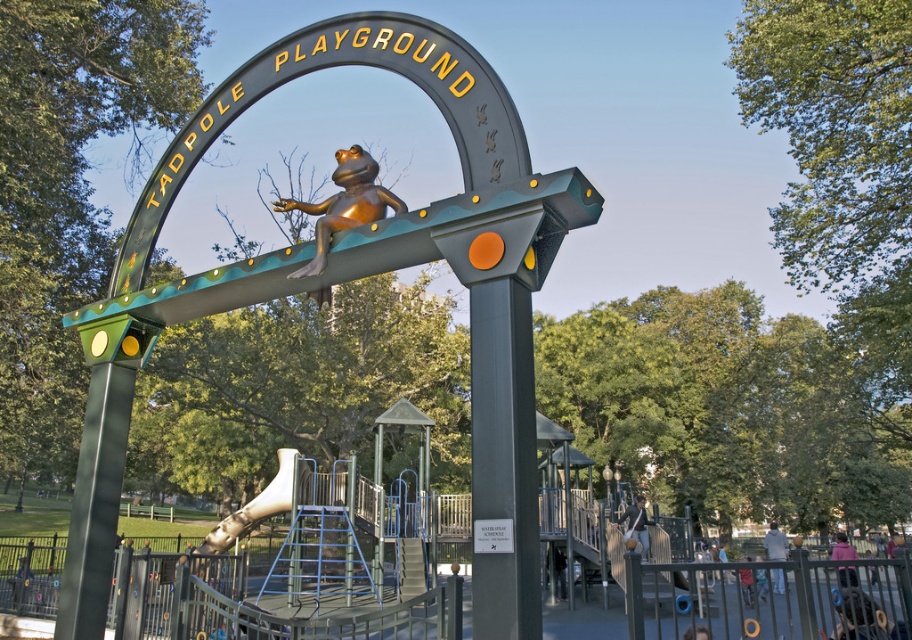
You are a parent trying to locate the slide for your child. From the entrance arch, which side of the metallic silver slide at center has the bronze shiny frog at center?

The bronze shiny frog at center is positioned on the right side of the metallic silver slide at center, so it is to the right of the slide.

You are a parent trying to take a photo of your child playing at the entrance of Tadpole Playground. You want to include both the bronze shiny frog at center and the metallic silver slide at center in the same frame. Which object should you position closer to the camera to ensure both fit in the photo?

To include both the bronze shiny frog at center and the metallic silver slide at center in the same frame, position the metallic silver slide at center closer to the camera since it is wider than the bronze shiny frog at center. This way, the wider slide can be accommodated without overfilling the frame while the smaller frog remains in view.

You are a parent trying to determine if there is enough space between the bronze shiny frog at center and the metallic silver slide at center for your child to walk through. Can you confirm if the space between them is sufficient?

The bronze shiny frog at center occupies less space than metallic silver slide at center, so there should be enough space for your child to walk between them.